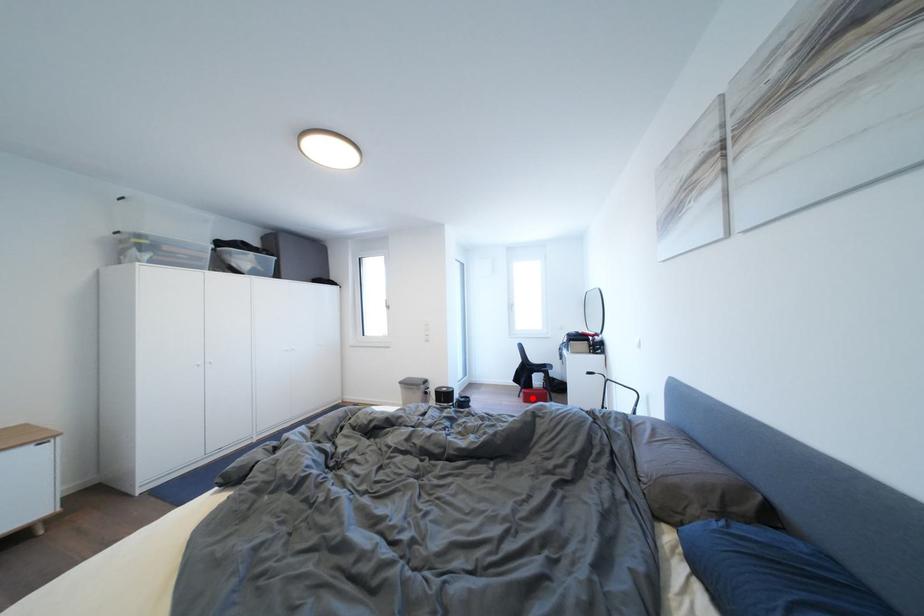
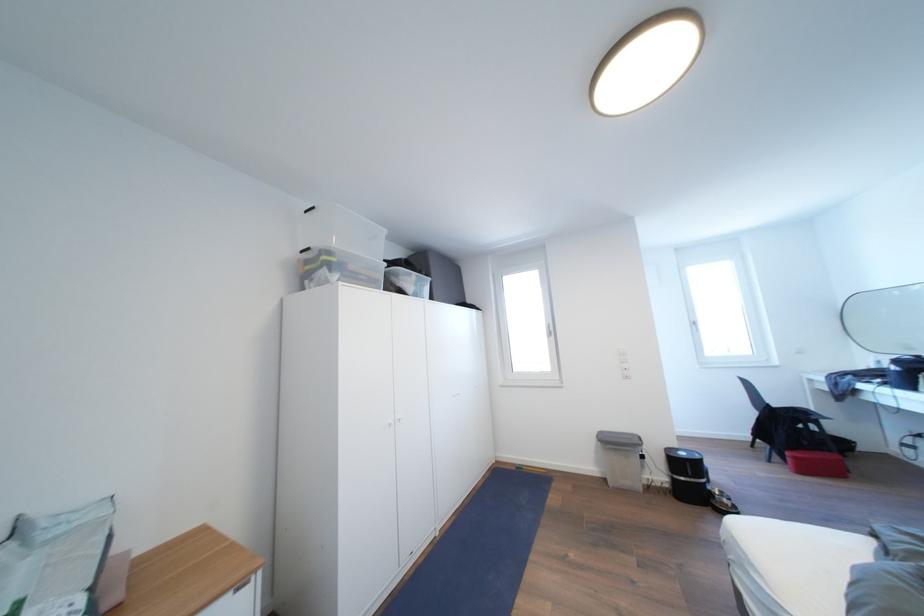
Where in the second image is the point corresponding to the highlighted location from the first image?

(803, 463)